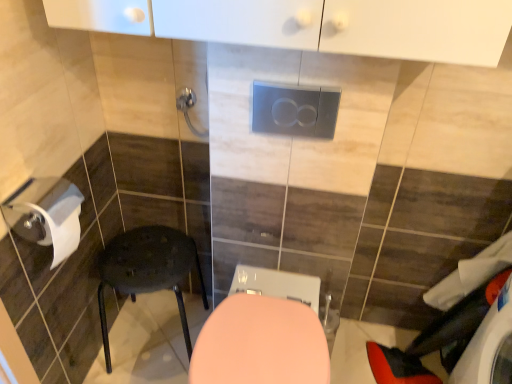
Locate an element on the screen. Image resolution: width=512 pixels, height=384 pixels. free space above matte black stool at lower left (from a real-world perspective) is located at coordinates (137, 271).